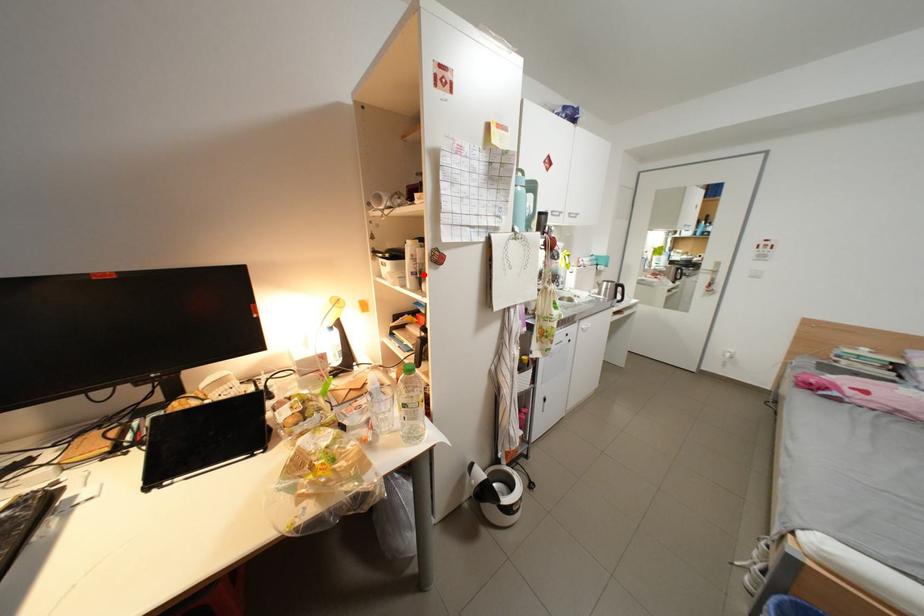
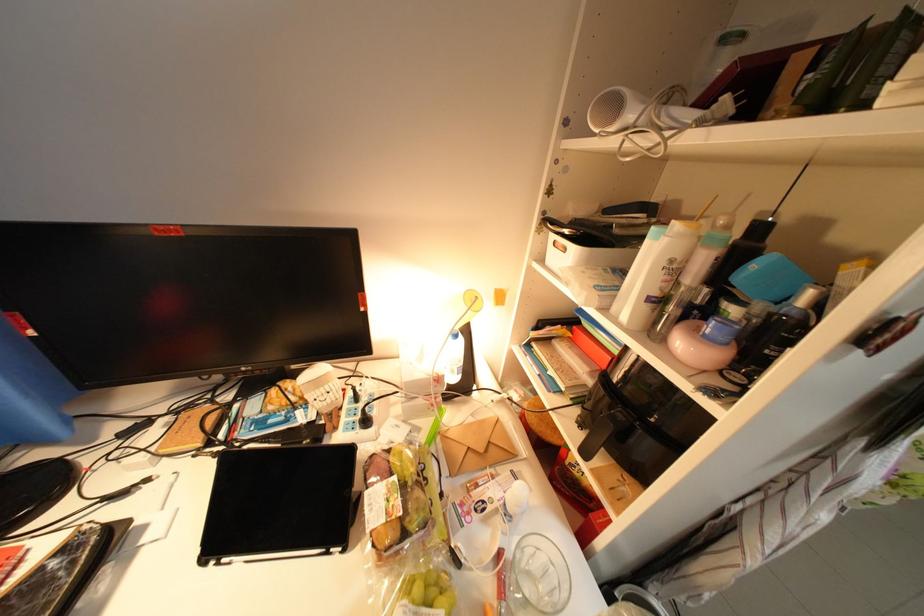
In the second image, find the point that corresponds to the highlighted location in the first image.

(661, 301)